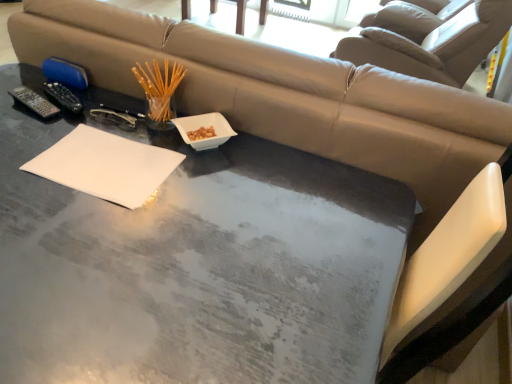
In order to face translucent glass chopsticks at upper left, should I rotate leftwards or rightwards?

Rotate left and turn 12.386 degrees.

In order to click on translucent glass chopsticks at upper left in this screenshot , I will do `click(159, 88)`.

The image size is (512, 384). Describe the element at coordinates (205, 127) in the screenshot. I see `white ceramic bowl at center` at that location.

Where is `translucent glass chopsticks at upper left`? The height and width of the screenshot is (384, 512). translucent glass chopsticks at upper left is located at coordinates (159, 88).

Based on their positions, is wooden chair at upper center located to the left or right of white ceramic bowl at center?

Based on their positions, wooden chair at upper center is located to the left of white ceramic bowl at center.

From the image's perspective, is wooden chair at upper center over white ceramic bowl at center?

Correct, wooden chair at upper center appears higher than white ceramic bowl at center in the image.

Based on the photo, can you confirm if wooden chair at upper center is thinner than white ceramic bowl at center?

No.

How different are the orientations of white ceramic bowl at center and translucent glass chopsticks at upper left in degrees?

white ceramic bowl at center and translucent glass chopsticks at upper left are facing 39.3 degrees away from each other.

Would you say white ceramic bowl at center is outside translucent glass chopsticks at upper left?

white ceramic bowl at center lies outside translucent glass chopsticks at upper left's area.

The width and height of the screenshot is (512, 384). What are the coordinates of `bowl below the translucent glass chopsticks at upper left (from the image's perspective)` in the screenshot? It's located at (205, 127).

From the image's perspective, is translucent glass chopsticks at upper left below beige leather swivel chair at upper center?

Indeed, from the image's perspective, translucent glass chopsticks at upper left is shown beneath beige leather swivel chair at upper center.

Is translucent glass chopsticks at upper left positioned in front of beige leather swivel chair at upper center?

Yes, translucent glass chopsticks at upper left is closer to the camera.

Is translucent glass chopsticks at upper left facing away from beige leather swivel chair at upper center?

Correct, translucent glass chopsticks at upper left is looking away from beige leather swivel chair at upper center.

Would you say translucent glass chopsticks at upper left contains beige leather swivel chair at upper center?

No, beige leather swivel chair at upper center is not a part of translucent glass chopsticks at upper left.

Is black plastic remote at left bigger than translucent glass chopsticks at upper left?

No.

From a real-world perspective, who is located lower, black plastic remote at left or translucent glass chopsticks at upper left?

From a 3D spatial view, black plastic remote at left is below.

You are a GUI agent. You are given a task and a screenshot of the screen. Output one action in this format:
    pyautogui.click(x=<x>, y=<y>)
    Task: Click on the chopstick above the black plastic remote at left (from the image's perspective)
    Image resolution: width=512 pixels, height=384 pixels.
    Given the screenshot: What is the action you would take?
    pyautogui.click(x=159, y=88)

Does black plastic remote at left touch translucent glass chopsticks at upper left?

They are not placed beside each other.

Visually, is black plastic remote at left positioned to the left or to the right of white matte notepad at center?

Based on their positions, black plastic remote at left is located to the left of white matte notepad at center.

In the scene shown: In terms of height, does black plastic remote at left look taller or shorter compared to white matte notepad at center?

black plastic remote at left is taller than white matte notepad at center.

Is black plastic remote at left with white matte notepad at center?

They are not placed beside each other.

From a real-world perspective, is black plastic remote at left above or below white matte notepad at center?

From a real-world perspective, black plastic remote at left is physically above white matte notepad at center.

From the image's perspective, is white ceramic bowl at center above or below white matte notepad at center?

white ceramic bowl at center is situated higher than white matte notepad at center in the image.

Does white ceramic bowl at center have a lesser width compared to white matte notepad at center?

Yes.

Can you confirm if white ceramic bowl at center is shorter than white matte notepad at center?

No.

Between white ceramic bowl at center and white matte notepad at center, which one appears on the right side from the viewer's perspective?

white ceramic bowl at center.

You are a GUI agent. You are given a task and a screenshot of the screen. Output one action in this format:
    pyautogui.click(x=<x>, y=<y>)
    Task: Click on the swivel chair above the translucent glass chopsticks at upper left (from the image's perspective)
    This screenshot has height=384, width=512.
    Given the screenshot: What is the action you would take?
    pyautogui.click(x=429, y=40)

Which object is further away from the camera, beige leather swivel chair at upper center or translucent glass chopsticks at upper left?

beige leather swivel chair at upper center is more distant.

From a real-world perspective, is beige leather swivel chair at upper center located beneath translucent glass chopsticks at upper left?

Yes, from a real-world perspective, beige leather swivel chair at upper center is beneath translucent glass chopsticks at upper left.

Image resolution: width=512 pixels, height=384 pixels. Find the location of `bowl below the wooden chair at upper center (from the image's perspective)`. bowl below the wooden chair at upper center (from the image's perspective) is located at coordinates (205, 127).

Find the location of a particular element. This screenshot has height=384, width=512. bowl located in front of the translucent glass chopsticks at upper left is located at coordinates (205, 127).

When comparing their distances from black plastic remote at left, does beige leather swivel chair at upper center or white matte notepad at center seem further?

beige leather swivel chair at upper center is positioned further to the anchor black plastic remote at left.

Estimate the real-world distances between objects in this image. Which object is further from white ceramic bowl at center, translucent glass chopsticks at upper left or wooden chair at upper center?

wooden chair at upper center lies further to white ceramic bowl at center than the other object.

Based on their spatial positions, is white matte notepad at center or beige leather swivel chair at upper center closer to white ceramic bowl at center?

The object closer to white ceramic bowl at center is white matte notepad at center.

From the picture: Considering their positions, is black plastic remote at left positioned closer to wooden chair at upper center than white matte notepad at center?

black plastic remote at left lies closer to wooden chair at upper center than the other object.

Looking at this image, considering their positions, is beige leather swivel chair at upper center positioned further to black plastic remote at left than white ceramic bowl at center?

Among the two, beige leather swivel chair at upper center is located further to black plastic remote at left.

Which object lies nearer to the anchor point beige leather swivel chair at upper center, translucent glass chopsticks at upper left or wooden chair at upper center?

wooden chair at upper center is closer to beige leather swivel chair at upper center.

Considering their positions, is white ceramic bowl at center positioned closer to beige leather swivel chair at upper center than wooden chair at upper center?

wooden chair at upper center.

Considering their positions, is wooden chair at upper center positioned further to black plastic remote at left than white matte notepad at center?

wooden chair at upper center.

Find the location of a particular element. swivel chair located between translucent glass chopsticks at upper left and wooden chair at upper center in the depth direction is located at coordinates (429, 40).

This screenshot has height=384, width=512. What are the coordinates of `swivel chair between white ceramic bowl at center and wooden chair at upper center in the front-back direction` in the screenshot? It's located at (429, 40).

Identify the location of chopstick between black plastic remote at left and white ceramic bowl at center from left to right. The width and height of the screenshot is (512, 384). (159, 88).

Locate an element on the screen. This screenshot has width=512, height=384. swivel chair between white matte notepad at center and wooden chair at upper center in the front-back direction is located at coordinates (429, 40).